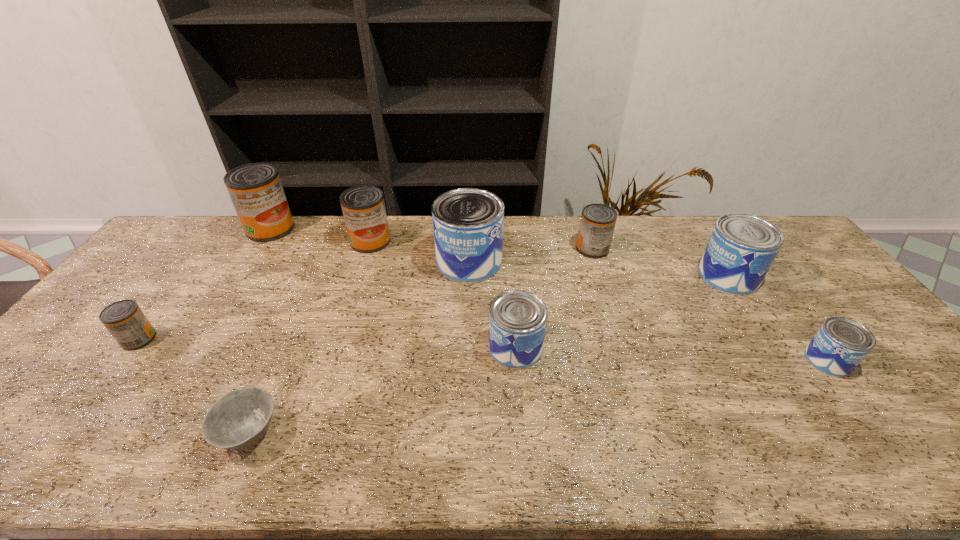
What are the coordinates of `the smallest red can` in the screenshot? It's located at [124, 319].

Where is `the smallest blue can`? The height and width of the screenshot is (540, 960). the smallest blue can is located at coordinates (838, 347).

In order to click on the nearest object in this screenshot , I will do `click(239, 419)`.

Locate an element on the screen. bowl is located at coordinates (239, 419).

Identify the location of vacant space located on the right of the biggest red can. The width and height of the screenshot is (960, 540). (380, 228).

Identify the location of vacant area situated on the front label of the biggest blue can. The height and width of the screenshot is (540, 960). (590, 261).

The image size is (960, 540). What are the coordinates of `vacant region located on the front of the third can from left to right` in the screenshot? It's located at (343, 329).

Find the location of `vacant region located on the front label of the second biggest blue can`. vacant region located on the front label of the second biggest blue can is located at coordinates (601, 276).

Locate an element on the screen. blank space located on the front label of the second biggest blue can is located at coordinates 649,276.

Identify the location of vacant position located on the front label of the second biggest blue can. (633, 276).